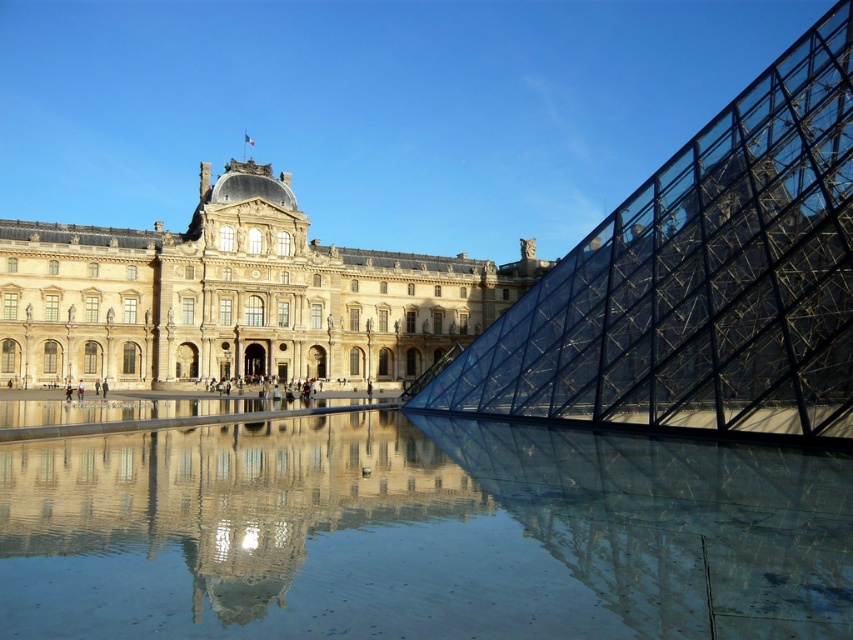
You are standing in the middle of the image and want to walk towards the transparent glass water at center. Which direction should you move relative to the beige stone palace at center?

Since the transparent glass water at center is to the right of the beige stone palace at center, you should move to the right to reach the transparent glass water at center.

Based on the photo, you are an architect evaluating the spatial relationship between the transparent glass water at center and the beige stone palace at center in the image. Which object occupies more space in the scene?

The beige stone palace at center occupies more space in the scene than the transparent glass water at center, as the description states that the transparent glass water at center has a smaller size compared to the beige stone palace at center.